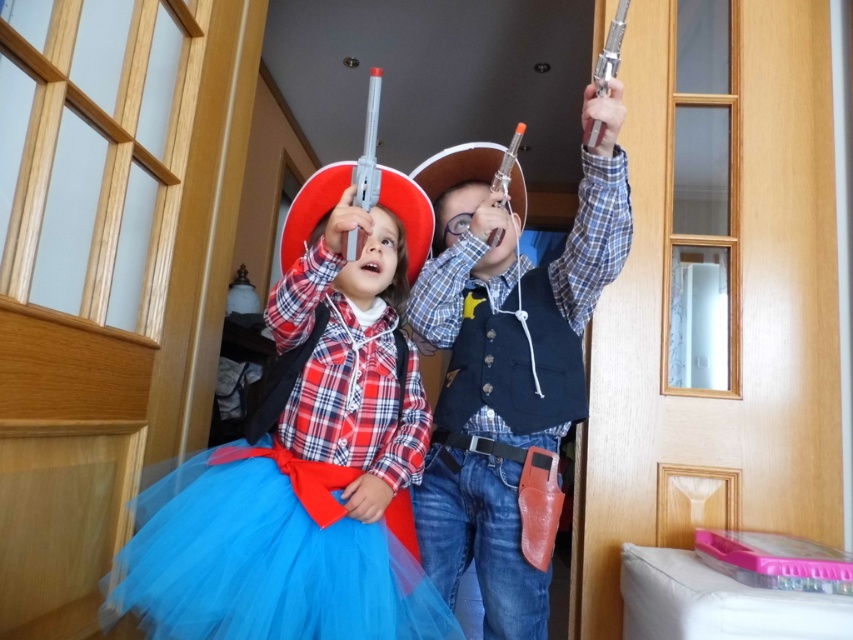
You are a photographer trying to capture a photo of both the matte red cowboy hat at upper center and the matte plastic toy gun at center. Since you want to ensure both are in frame, can you tell me which object is on the left side?

The matte red cowboy hat at upper center is positioned on the left side of the matte plastic toy gun at center, so it is on the left.

You are a parent trying to clean up toys in the hallway. The matte plastic toy gun at center and the blue tulle ballet skirt at lower center are in the way. Which object is blocking the path more because it is above the other?

The matte plastic toy gun at center is positioned over blue tulle ballet skirt at lower center, so it is blocking the path more because it is above the other.